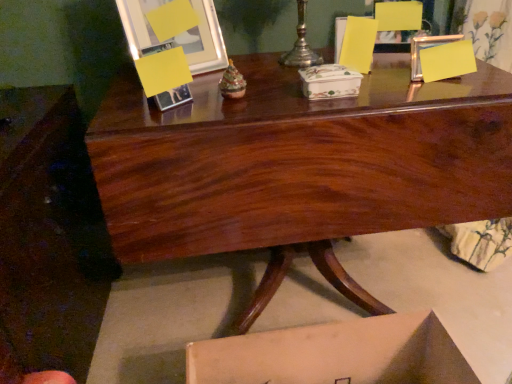
Question: Looking at the image, does matte wood armchair at upper right seem bigger or smaller compared to glossy wood desk at center?

Choices:
 (A) small
 (B) big

Answer: (A)

Question: Is matte wood armchair at upper right taller or shorter than glossy wood desk at center?

Choices:
 (A) tall
 (B) short

Answer: (B)

Question: Which object is the closest to the metallic silver picture frame at upper left?

Choices:
 (A) glossy wood desk at center
 (B) matte wood armchair at upper right
 (C) silver metallic candle holder at upper center
 (D) porcelain floral box at center

Answer: (C)

Question: Which of these objects is positioned farthest from the metallic silver picture frame at upper left?

Choices:
 (A) silver metallic candle holder at upper center
 (B) glossy wood desk at center
 (C) matte wood armchair at upper right
 (D) porcelain floral box at center

Answer: (C)